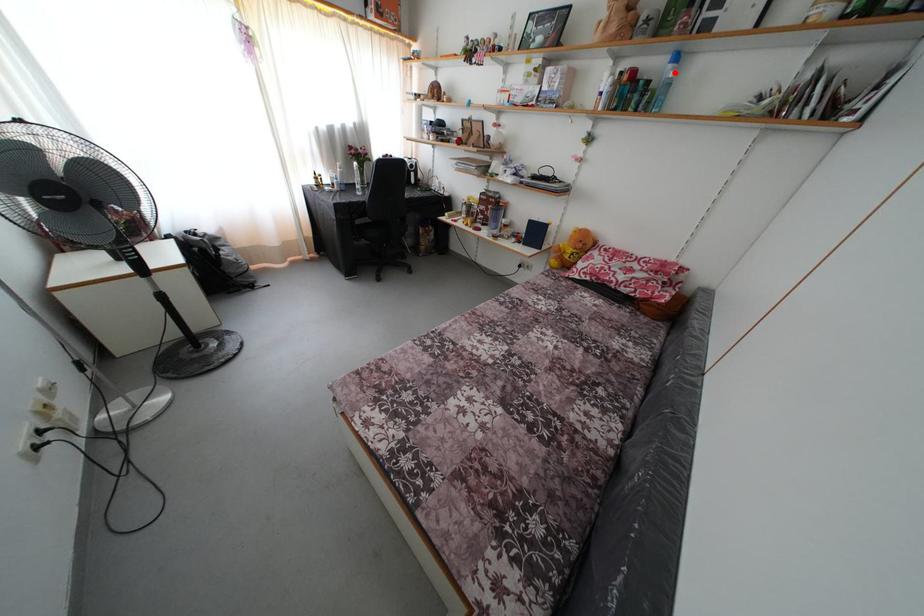
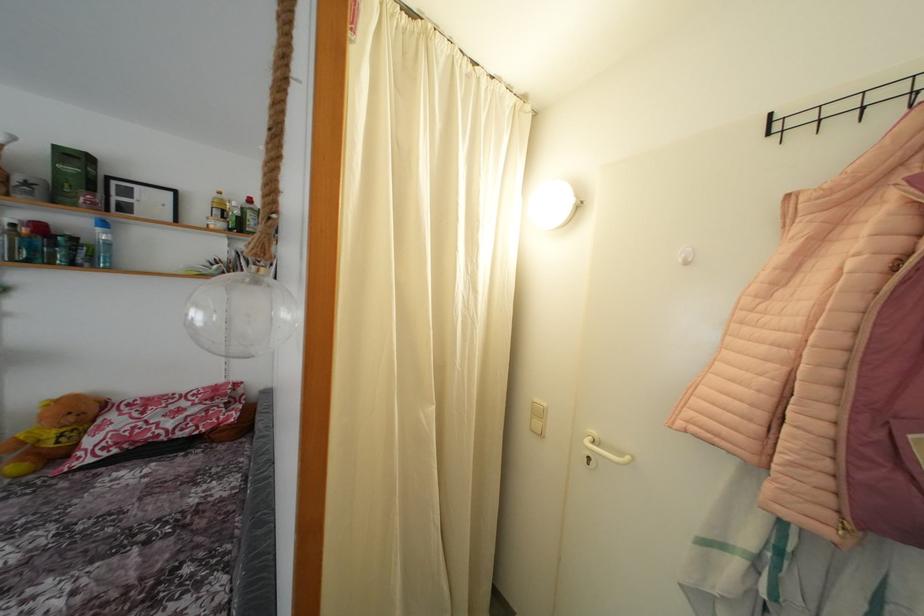
Where in the second image is the point corresponding to the highlighted location from the first image?

(104, 236)